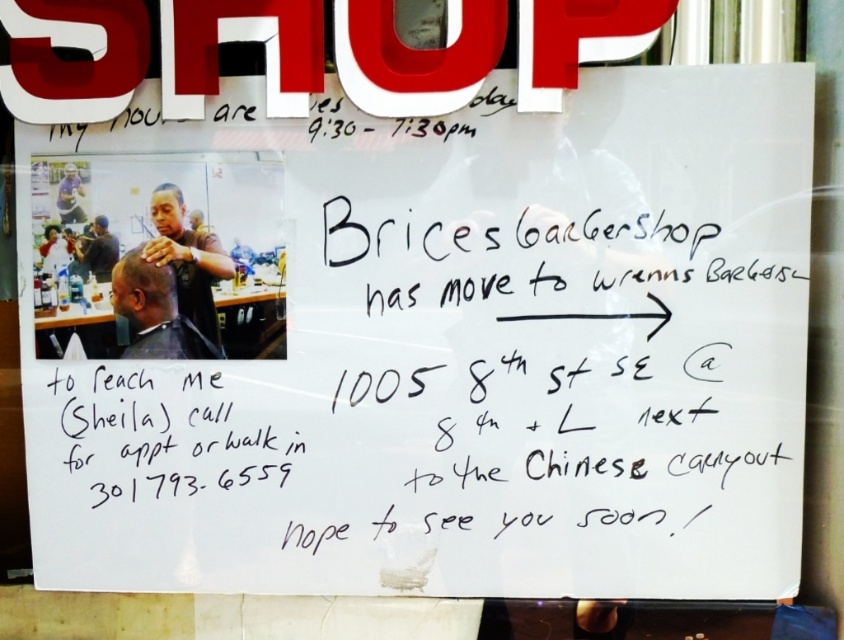
In the scene shown: You are a customer looking for the new location of Brices Barbershop. You see the notice with the matte black barber chair at upper left and the dark brown hair at center. According to the arrow pointing to the right on the notice, which direction should you go to find the new location?

The arrow on the notice points to the right, so you should go in the direction of the matte black barber chair at upper left, which is to the right of the dark brown hair at center, to find the new location of Brices Barbershop.

You are standing in front of the barbershop notice. There is a point marked at coordinates [155,310]. What does this point indicate?

The point at [155,310] indicates the location of the dark brown hair at upper left.